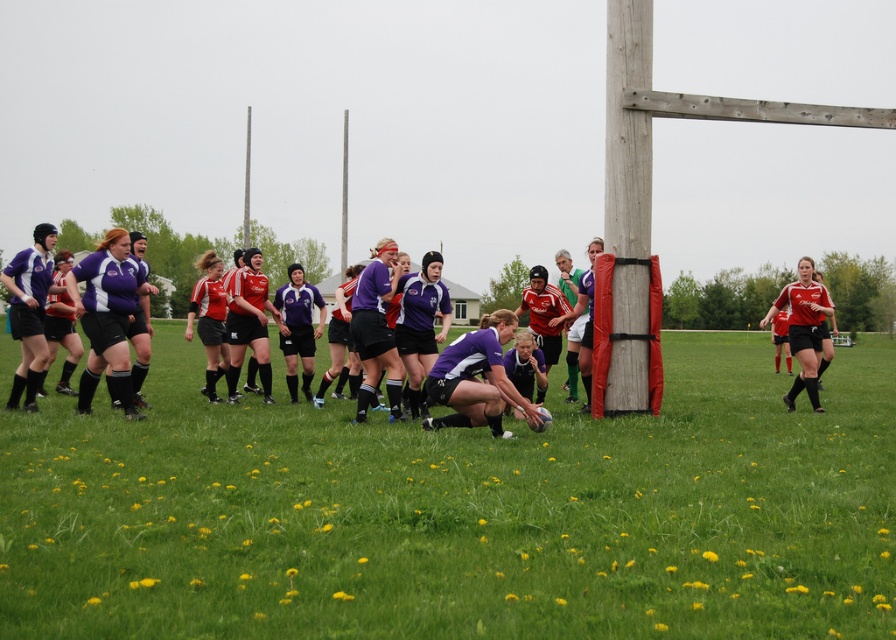
Question: Can you confirm if purple matte jersey at center is positioned to the left of matte red jersey at right?

Choices:
 (A) yes
 (B) no

Answer: (A)

Question: Can you confirm if purple matte jersey at center is thinner than matte red jersey at right?

Choices:
 (A) yes
 (B) no

Answer: (A)

Question: Among these points, which one is nearest to the camera?

Choices:
 (A) (808, 272)
 (B) (498, 378)

Answer: (B)

Question: Does green grass at center appear over matte red jersey at right?

Choices:
 (A) yes
 (B) no

Answer: (B)

Question: Which of the following is the farthest from the observer?

Choices:
 (A) matte red jersey at right
 (B) green grass at center

Answer: (A)

Question: Which is farther from the matte red jersey at right?

Choices:
 (A) green grass at center
 (B) purple matte jersey at center

Answer: (A)